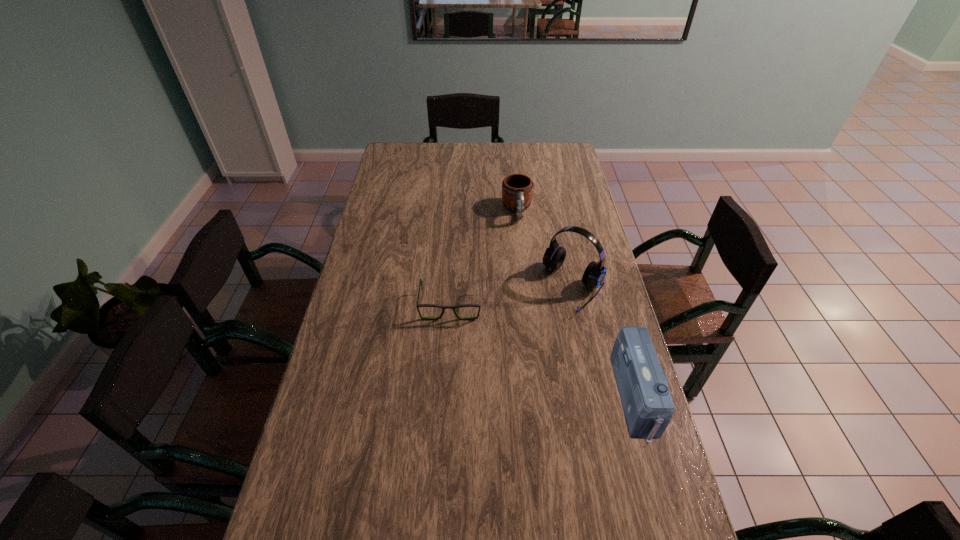
You are a GUI agent. You are given a task and a screenshot of the screen. Output one action in this format:
    pyautogui.click(x=<x>, y=<y>)
    Task: Click on the free spot on the desktop that is between the leftmost object and the nearest object and is positioned on the side of the third tallest object with the handle
    The width and height of the screenshot is (960, 540).
    Given the screenshot: What is the action you would take?
    pyautogui.click(x=539, y=348)

I want to click on vacant space on the desktop that is between the spectacles and the nearest object and is positioned on the ear cushions of the tallest object, so click(529, 343).